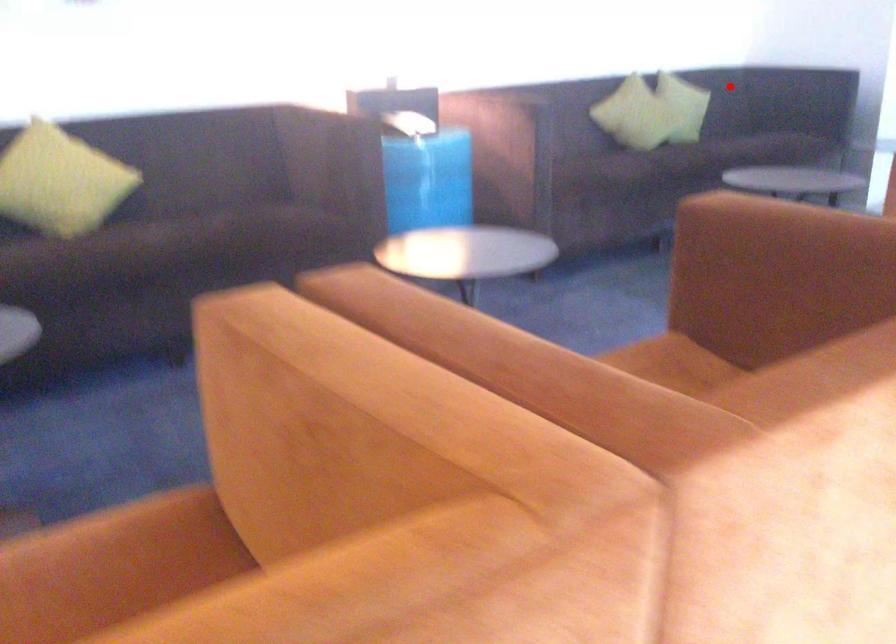
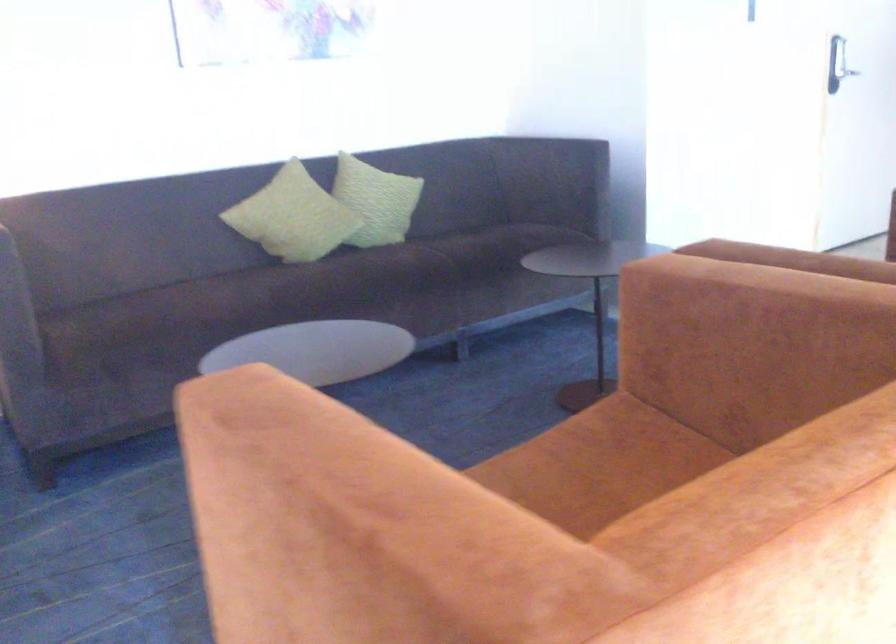
Where in the second image is the point corresponding to the highlighted location from the first image?

(375, 201)